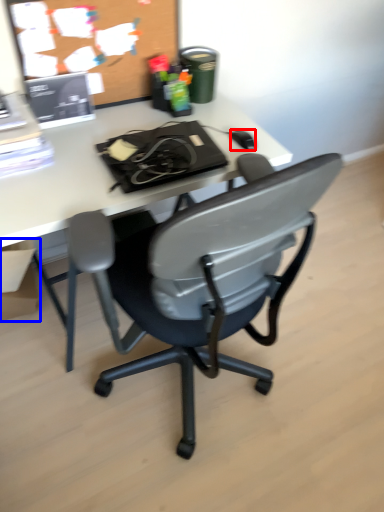
Question: Which point is further to the camera, mouse (highlighted by a red box) or box (highlighted by a blue box)?

Choices:
 (A) mouse
 (B) box

Answer: (B)